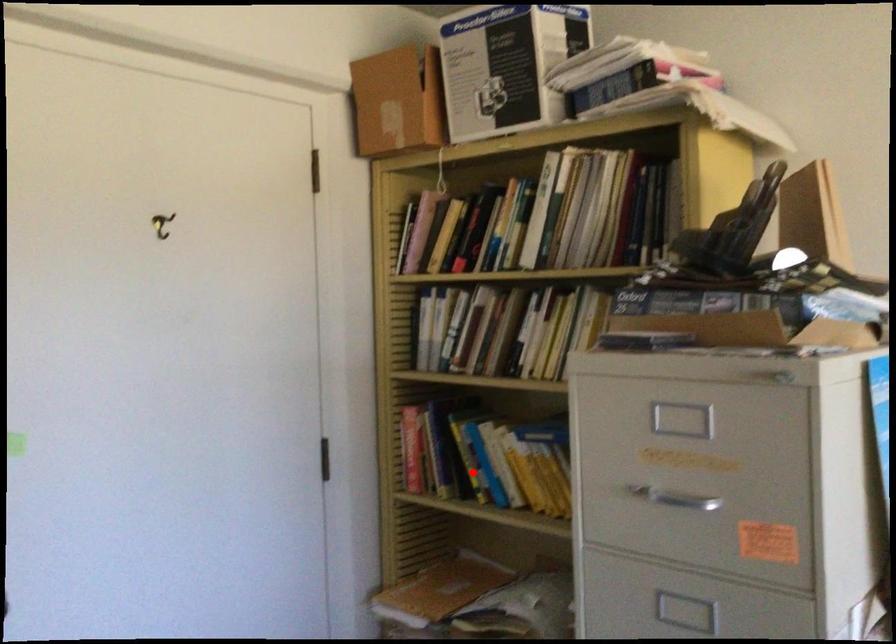
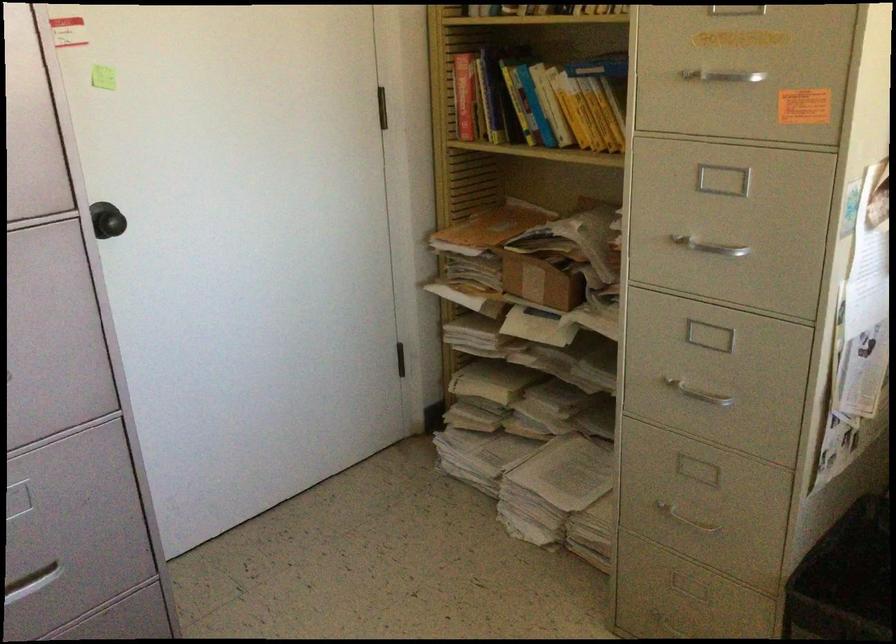
Find the pixel in the second image that matches the highlighted location in the first image.

(523, 111)